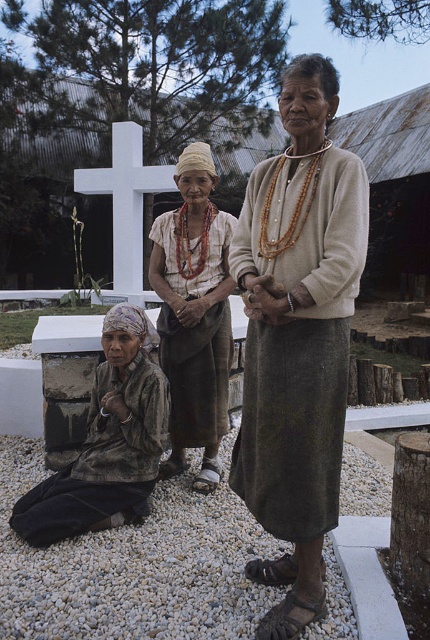
You are standing at the edge of the cemetery and want to place a small flower on the white gravel at lower center. Based on the coordinates provided in the Objects Description, can you determine the exact location to place the flower?

The white gravel at lower center is located at point (x=134, y=566), so you should place the flower at those coordinates.